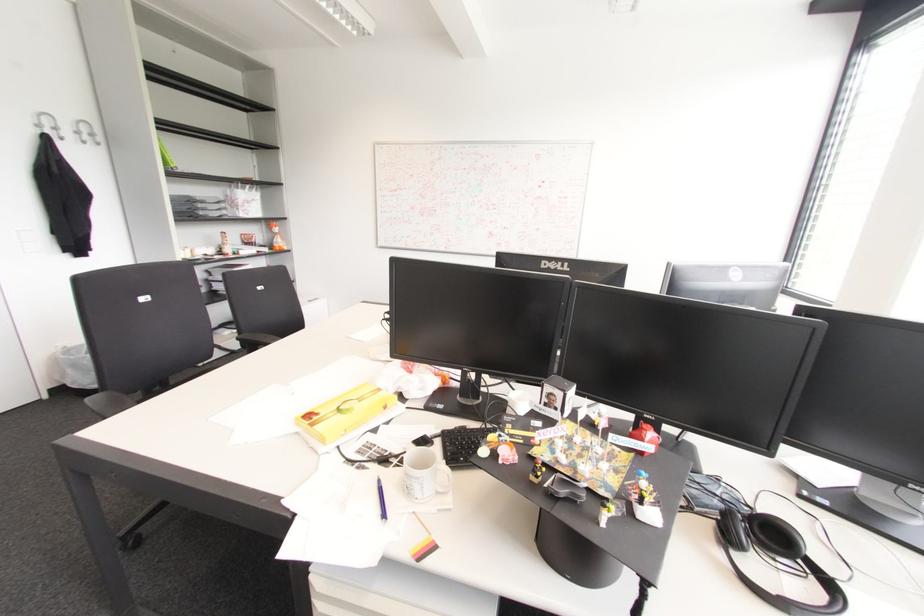
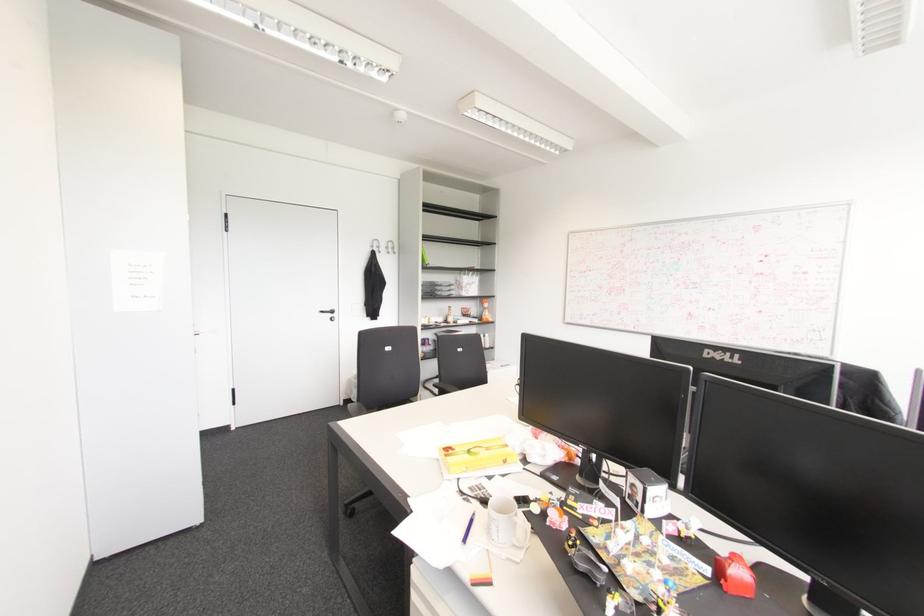
Where in the second image is the point corresponding to the point at 38,126 from the first image?

(371, 246)